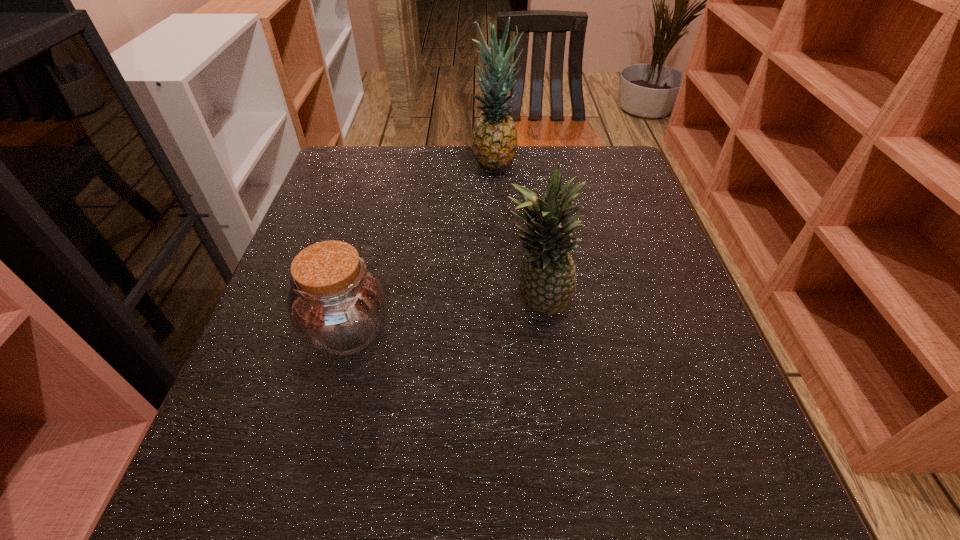
Locate an element on the screen. free spot between the jar and the farthest object is located at coordinates (421, 247).

The height and width of the screenshot is (540, 960). What are the coordinates of `vacant space in between the taller pineapple and the leftmost object` in the screenshot? It's located at (421, 247).

Locate an element on the screen. free space between the second shortest object and the tallest object is located at coordinates (516, 233).

At what (x,y) coordinates should I click in order to perform the action: click on empty space between the nearer pineapple and the tallest object. Please return your answer as a coordinate pair (x, y). The width and height of the screenshot is (960, 540). Looking at the image, I should click on (516, 233).

Locate an element on the screen. This screenshot has width=960, height=540. empty location between the shortest object and the nearer pineapple is located at coordinates (443, 317).

Locate an element on the screen. This screenshot has height=540, width=960. vacant point located between the second tallest object and the taller pineapple is located at coordinates (516, 233).

I want to click on free space between the second tallest object and the taller pineapple, so 516,233.

Locate an element on the screen. free space between the taller pineapple and the second tallest object is located at coordinates (516, 233).

Locate an element on the screen. The height and width of the screenshot is (540, 960). vacant area that lies between the farther pineapple and the nearer pineapple is located at coordinates (516, 233).

I want to click on object that is the nearest to the jar, so click(x=547, y=283).